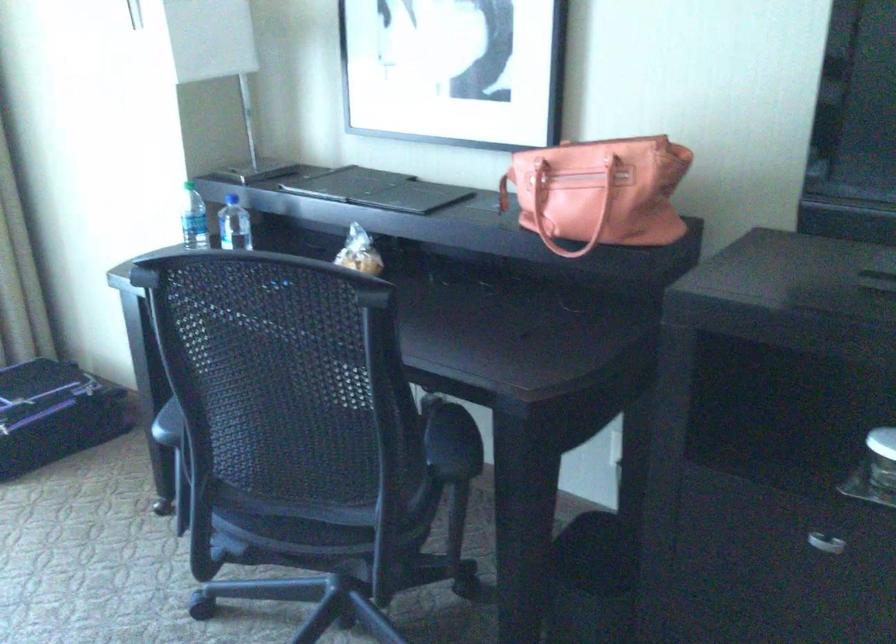
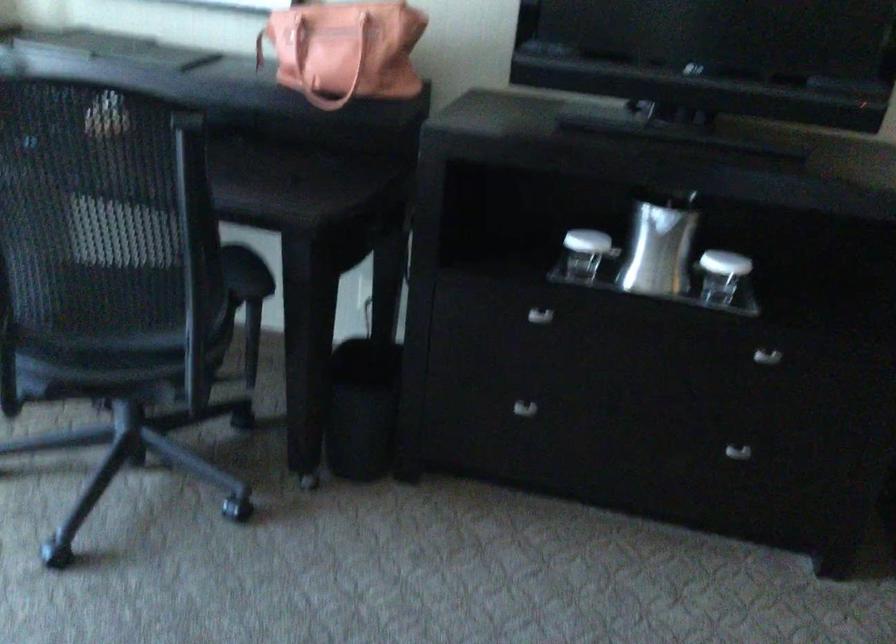
In the second image, find the point that corresponds to [823,538] in the first image.

(539, 316)